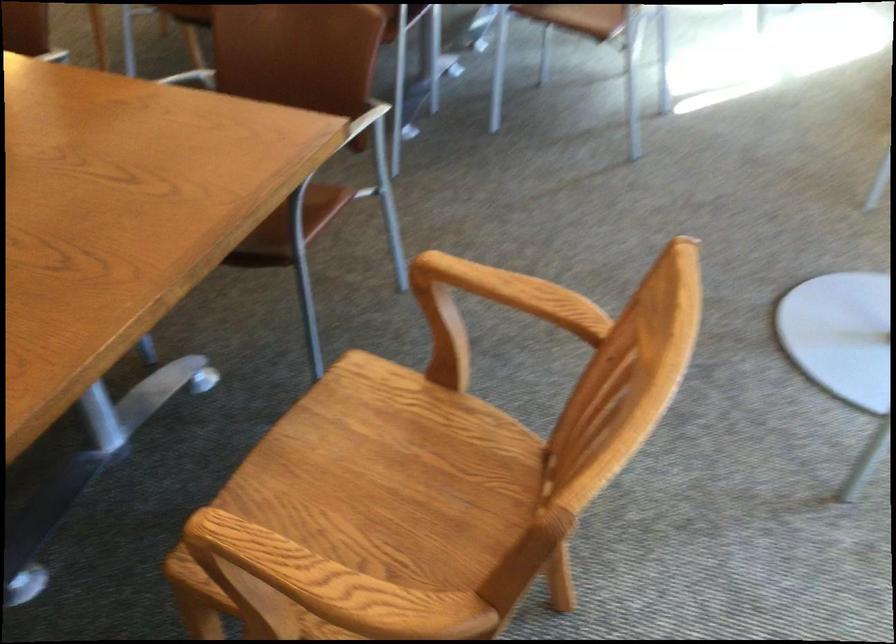
Find where to sit the wooden chair sitting surface. Please return your answer as a coordinate pair (x, y).

(378, 487)